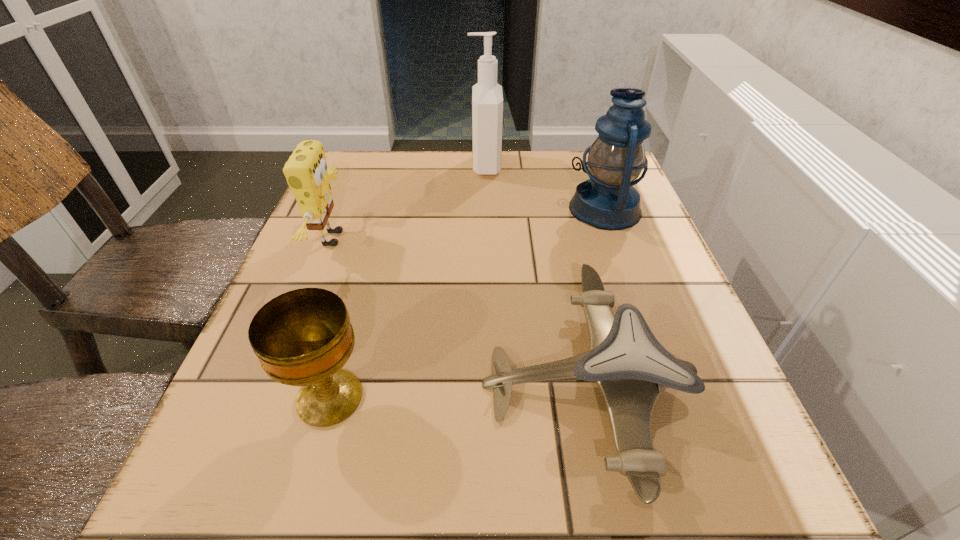
Where is `vacant area at the near left corner of the desktop`? The width and height of the screenshot is (960, 540). vacant area at the near left corner of the desktop is located at coordinates (295, 491).

Identify the location of unoccupied position between the cleansing agent and the sponge. The width and height of the screenshot is (960, 540). (410, 202).

Where is `free point between the shortest object and the sponge`? Image resolution: width=960 pixels, height=540 pixels. free point between the shortest object and the sponge is located at coordinates (460, 312).

The width and height of the screenshot is (960, 540). Find the location of `vacant area between the fourth tallest object and the cleansing agent`. vacant area between the fourth tallest object and the cleansing agent is located at coordinates (407, 282).

At what (x,y) coordinates should I click in order to perform the action: click on unoccupied position between the sponge and the farthest object. Please return your answer as a coordinate pair (x, y). This screenshot has width=960, height=540. Looking at the image, I should click on (410, 202).

Find the location of a particular element. The width and height of the screenshot is (960, 540). free spot between the second tallest object and the chalice is located at coordinates (x=468, y=303).

The image size is (960, 540). I want to click on free space between the cleansing agent and the sponge, so click(x=410, y=202).

Image resolution: width=960 pixels, height=540 pixels. What are the coordinates of `empty location between the fourth tallest object and the lantern` in the screenshot? It's located at (468, 303).

The image size is (960, 540). What are the coordinates of `free spot between the tallest object and the chalice` in the screenshot? It's located at (407, 282).

Image resolution: width=960 pixels, height=540 pixels. In order to click on free space that is in between the lantern and the sponge in this screenshot , I will do `click(469, 224)`.